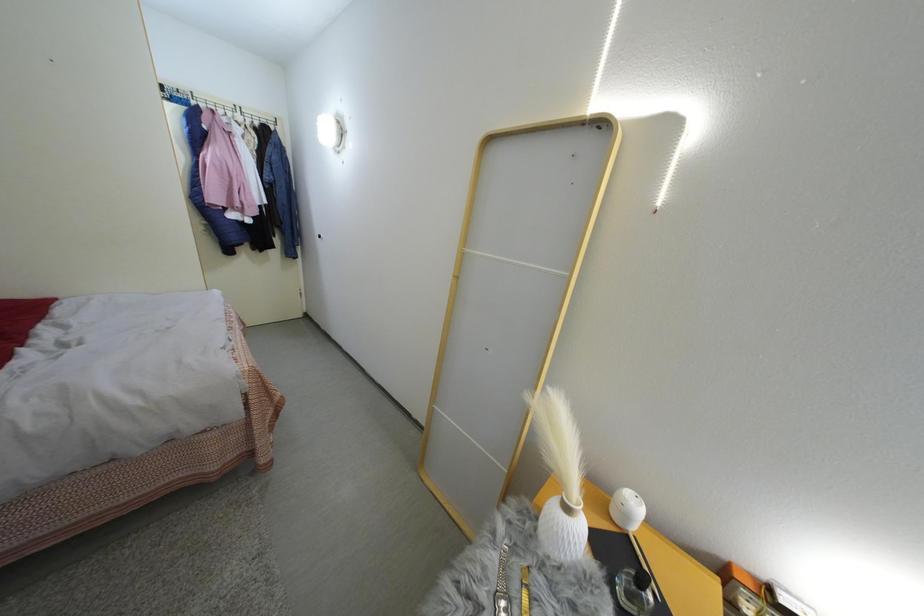
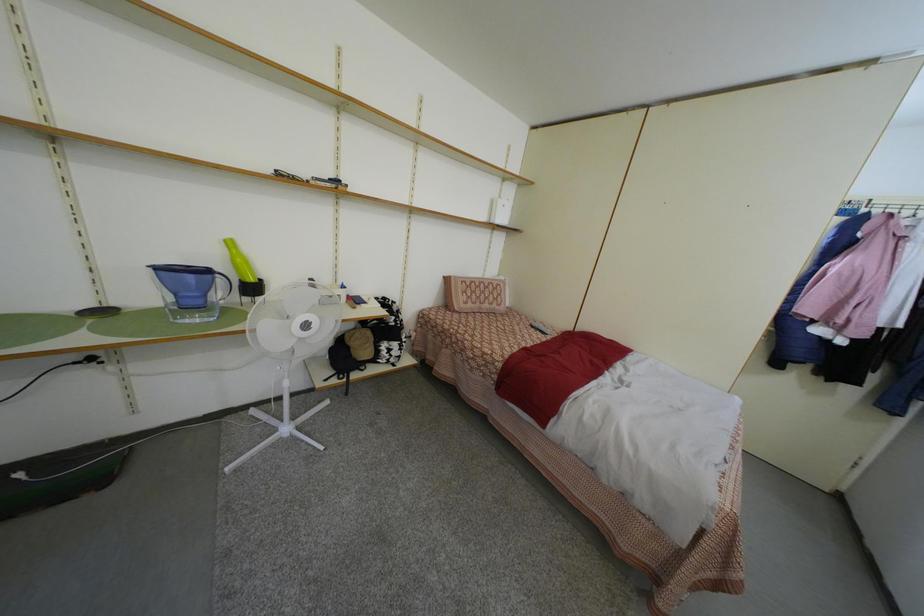
Question: The first image is from the beginning of the video and the second image is from the end. How did the camera likely rotate when shooting the video?

Choices:
 (A) Left
 (B) Right
 (C) Up
 (D) Down

Answer: (A)